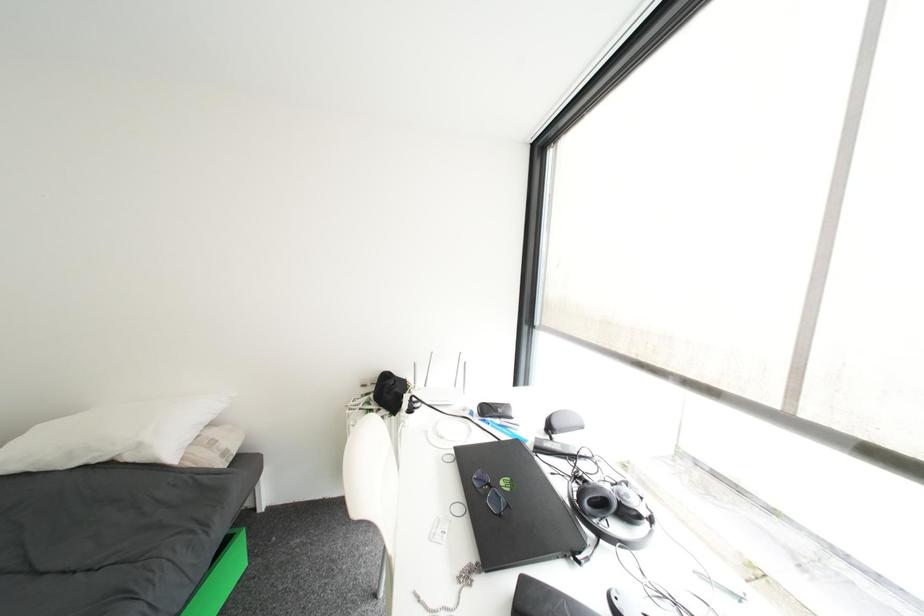
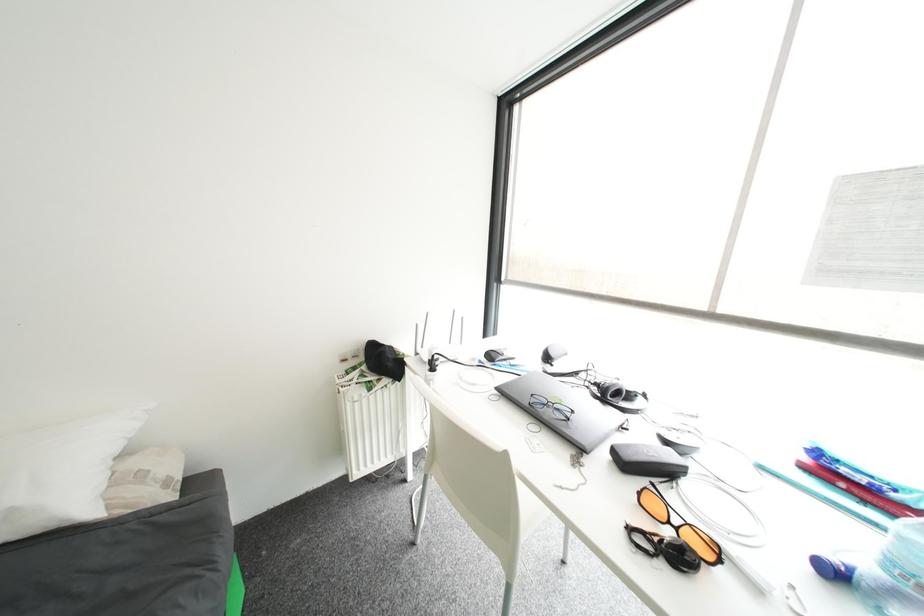
Question: What movement of the cameraman would produce the second image?

Choices:
 (A) Left
 (B) Right
 (C) Forward
 (D) Backward

Answer: (A)